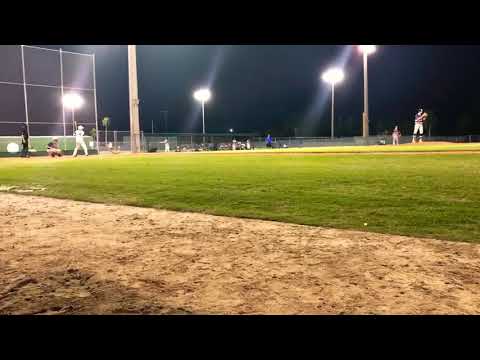
You are a GUI agent. You are given a task and a screenshot of the screen. Output one action in this format:
    pyautogui.click(x=<x>, y=<y>)
    Task: Click on the lights
    This screenshot has width=480, height=360.
    Given the screenshot: What is the action you would take?
    pyautogui.click(x=74, y=100), pyautogui.click(x=204, y=96), pyautogui.click(x=336, y=76), pyautogui.click(x=367, y=49)